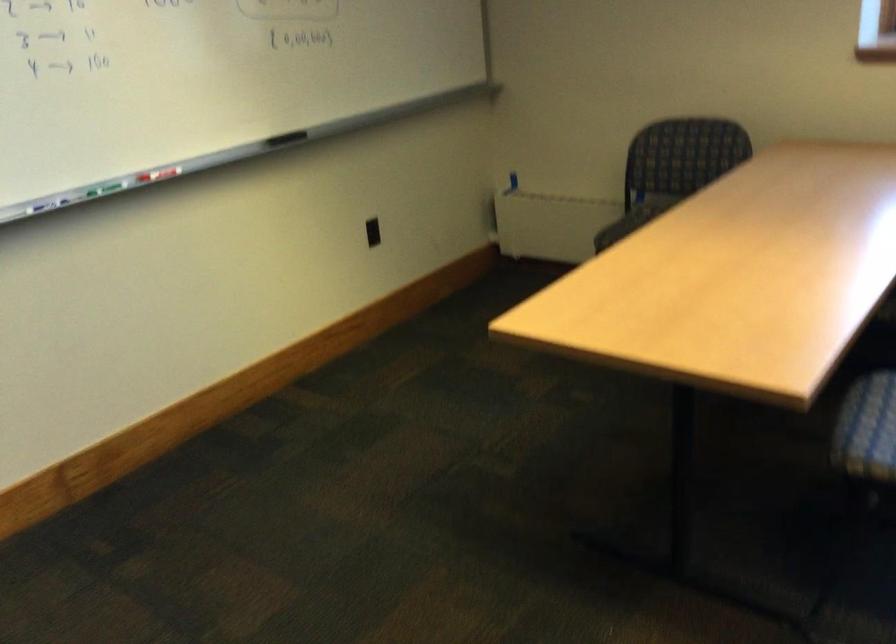
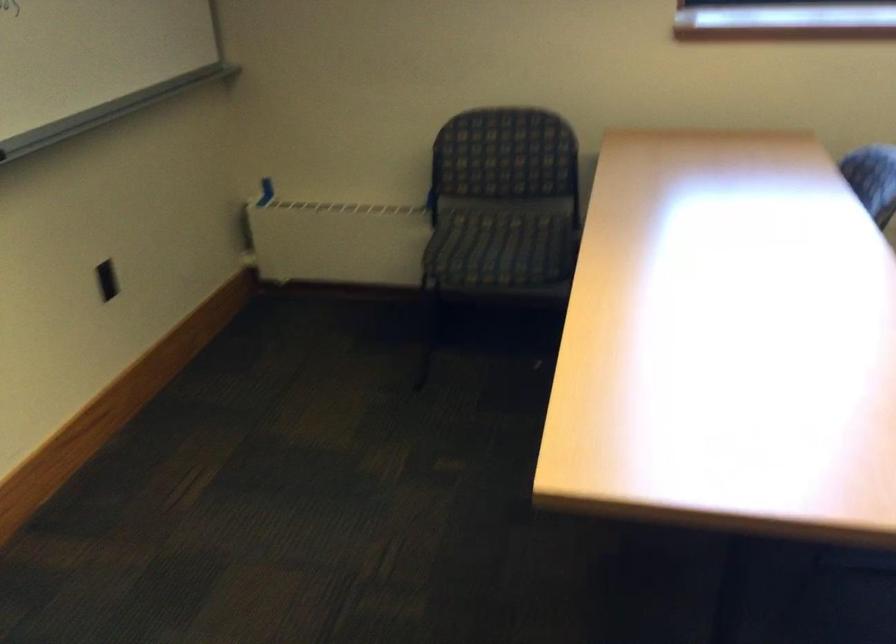
Question: Based on the continuous images, in which direction is the camera rotating? Reply with the corresponding letter.

Choices:
 (A) Left
 (B) Right
 (C) Up
 (D) Down

Answer: (B)